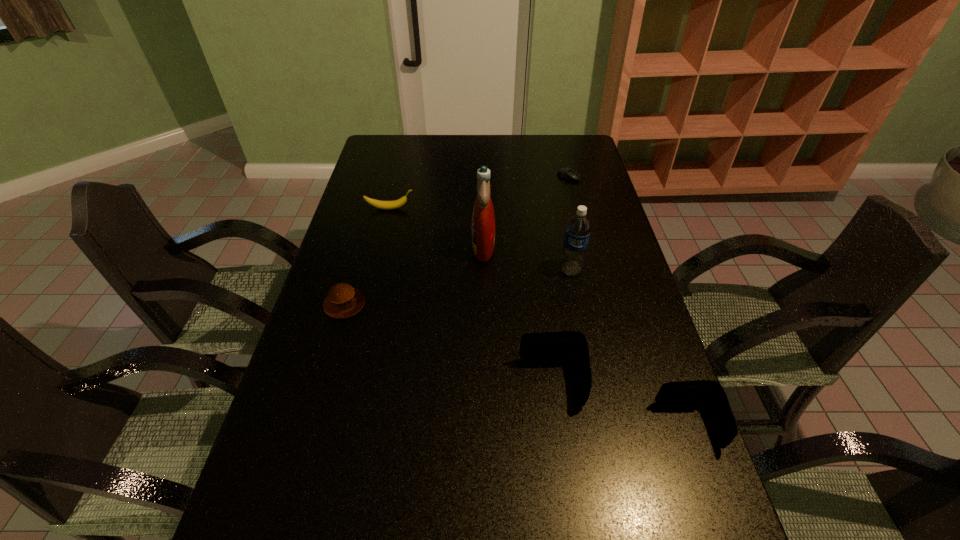
Identify the location of vacant space at the far edge of the desktop. Image resolution: width=960 pixels, height=540 pixels. pyautogui.click(x=544, y=160).

At what (x,y) coordinates should I click in order to perform the action: click on free region at the near edge of the desktop. Please return your answer as a coordinate pair (x, y). Image resolution: width=960 pixels, height=540 pixels. Looking at the image, I should click on (504, 496).

In order to click on free space at the left edge of the desktop in this screenshot , I will do `click(326, 289)`.

Where is `vacant space at the right edge of the desktop`? The height and width of the screenshot is (540, 960). vacant space at the right edge of the desktop is located at coordinates (608, 407).

The height and width of the screenshot is (540, 960). I want to click on vacant point at the far left corner, so click(382, 157).

Identify the location of vacant space at the near left corner of the desktop. This screenshot has width=960, height=540. pyautogui.click(x=290, y=512).

Identify the location of free spot between the rightmost object and the second shortest object. Image resolution: width=960 pixels, height=540 pixels. pyautogui.click(x=516, y=364).

At what (x,y) coordinates should I click in order to perform the action: click on empty location between the water bottle and the left wallet. Please return your answer as a coordinate pair (x, y). Looking at the image, I should click on (561, 326).

Identify the location of vacant space that's between the third object from left to right and the water bottle. This screenshot has width=960, height=540. (527, 259).

Identify the location of free spot between the left wallet and the muffin. This screenshot has width=960, height=540. (448, 343).